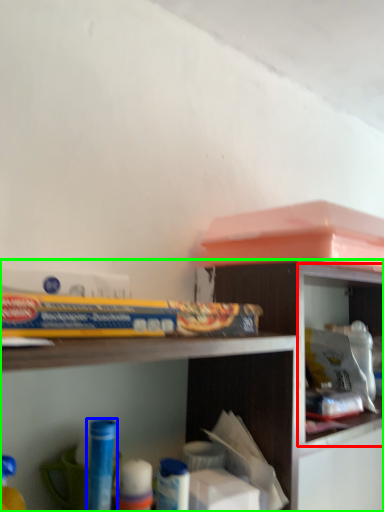
Question: Estimate the real-world distances between objects in this image. Which object is closer to cabinet (highlighted by a red box), toy (highlighted by a blue box) or shelf (highlighted by a green box)?

Choices:
 (A) toy
 (B) shelf

Answer: (B)